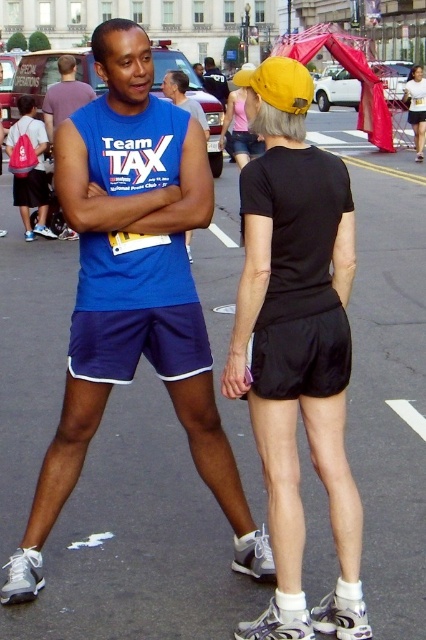
You are a photographer trying to capture the two individuals at the center of the image. The black matte shorts at center and the matte black shorts at center are both in focus. Since you want to highlight the wider pair of shorts, which one should you focus on?

The black matte shorts at center should be focused on because its width surpasses that of the matte black shorts at center.